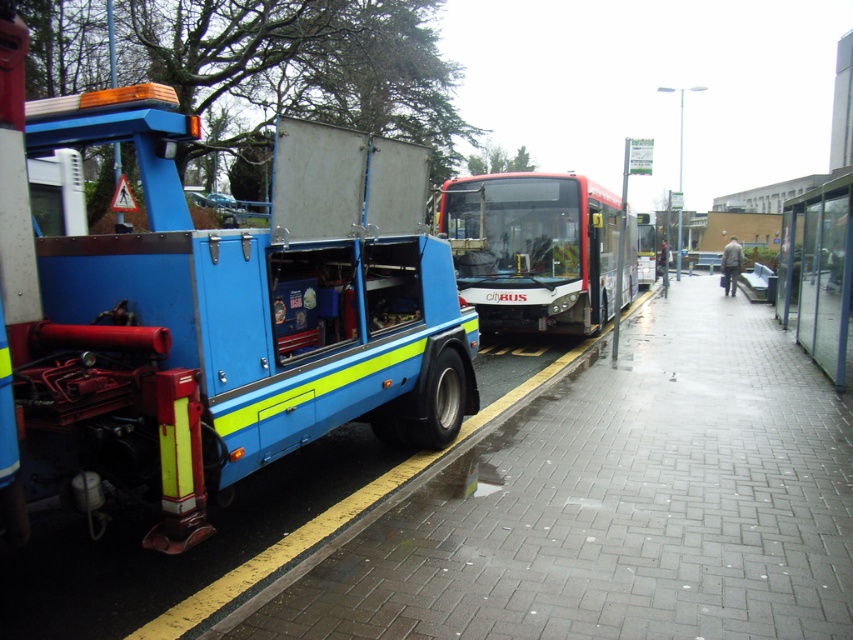
Is brick paved sidewalk at lower left taller than transparent glass bus stop at right?

No.

Is brick paved sidewalk at lower left bigger than transparent glass bus stop at right?

Answer: Incorrect, brick paved sidewalk at lower left is not larger than transparent glass bus stop at right.

Is point (817, 620) closer to viewer compared to point (793, 198)?

Yes.

You are a GUI agent. You are given a task and a screenshot of the screen. Output one action in this format:
    pyautogui.click(x=<x>, y=<y>)
    Task: Click on the brick paved sidewalk at lower left
    The width and height of the screenshot is (853, 640).
    Given the screenshot: What is the action you would take?
    pyautogui.click(x=616, y=502)

Between blue metallic tow truck at left and white glossy bus at center, which one is positioned lower?

Positioned lower is blue metallic tow truck at left.

Locate an element on the screen. blue metallic tow truck at left is located at coordinates (228, 314).

Is blue metallic tow truck at left below transparent glass bus stop at right?

Correct, blue metallic tow truck at left is located below transparent glass bus stop at right.

Between blue metallic tow truck at left and transparent glass bus stop at right, which one has less height?

blue metallic tow truck at left

Is point (399, 177) farther from viewer compared to point (845, 358)?

No.

In order to click on blue metallic tow truck at left in this screenshot , I will do `click(228, 314)`.